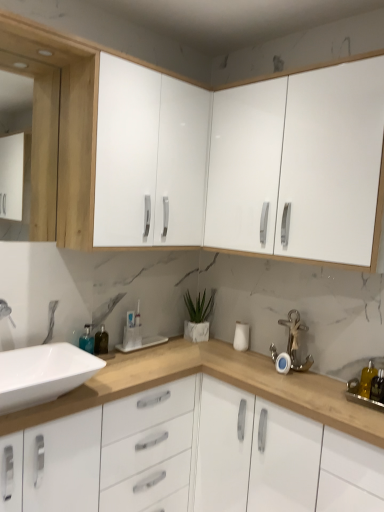
Where is `free space that is to the left of yellow translucent soap dispenser at right`? The image size is (384, 512). free space that is to the left of yellow translucent soap dispenser at right is located at coordinates (332, 391).